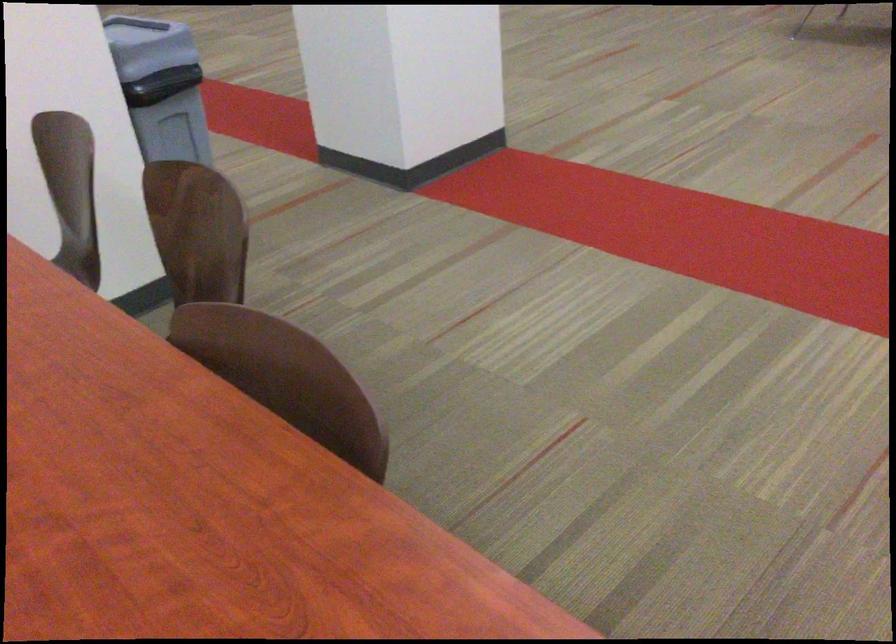
You are a GUI agent. You are given a task and a screenshot of the screen. Output one action in this format:
    pyautogui.click(x=<x>, y=<y>)
    Task: Click on the trash can lid handle
    This screenshot has height=644, width=896.
    Given the screenshot: What is the action you would take?
    pyautogui.click(x=135, y=24)